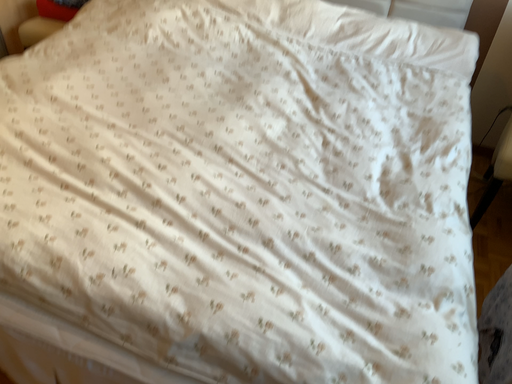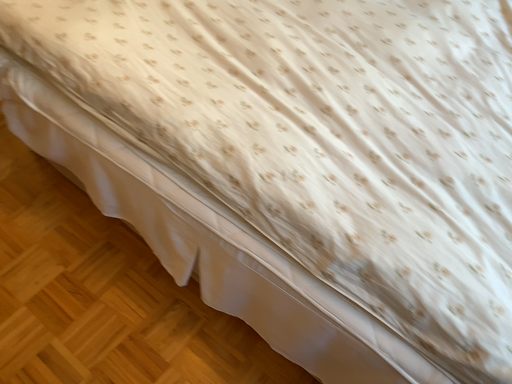
Question: Which way did the camera rotate in the video?

Choices:
 (A) rotated left
 (B) rotated right

Answer: (A)